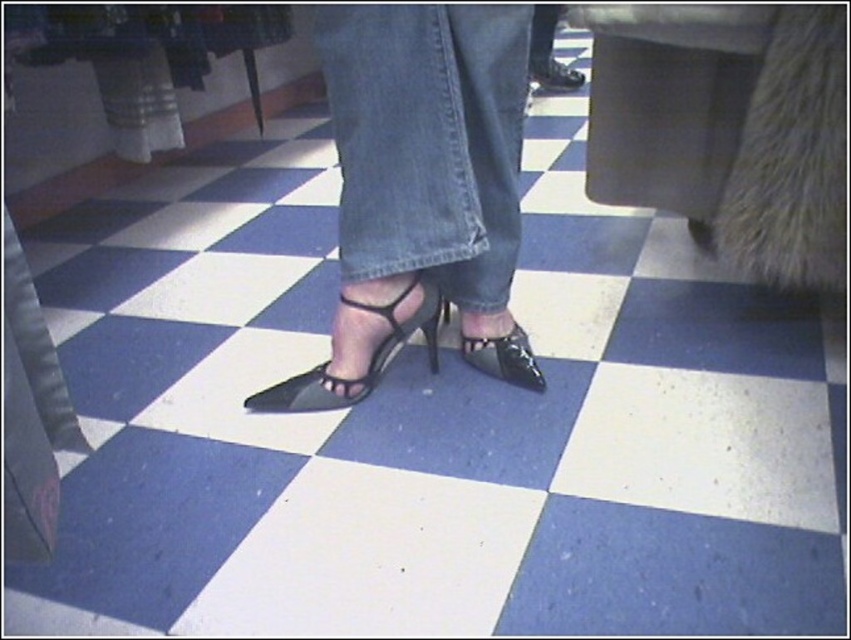
You are a robot trying to navigate between two points in the image. The first point is point (397, 182) and the second point is point (568, 81). Which point is closer to you?

Point (397, 182) is in front of point (568, 81), so the first point is closer to you.

You are a tailor measuring the size of the denim at center and the matte black shoe at center. Which object has a larger size?

The denim at center is larger in size than the matte black shoe at center.